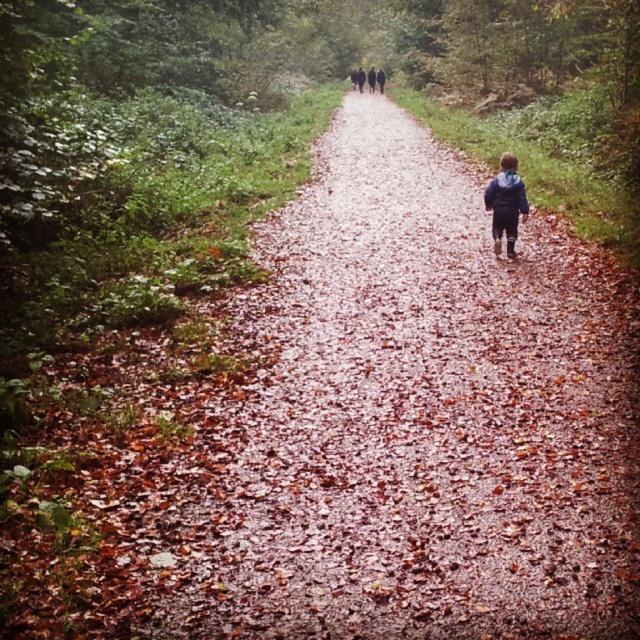
Question: Which point is farther to the camera?

Choices:
 (A) (381, 90)
 (B) (524, 624)

Answer: (A)

Question: Based on their relative distances, which object is farther from the dark blue jacket at center?

Choices:
 (A) brown leafy gravel path at center
 (B) blue fabric jacket at center

Answer: (B)

Question: Which object is closer to the camera taking this photo?

Choices:
 (A) dark blue jacket at center
 (B) blue fabric jacket at center
 (C) brown leafy gravel path at center

Answer: (C)

Question: Can you confirm if brown leafy gravel path at center is thinner than blue fabric jacket at center?

Choices:
 (A) yes
 (B) no

Answer: (B)

Question: In this image, where is blue fabric jacket at center located relative to dark blue jacket at center?

Choices:
 (A) above
 (B) below

Answer: (B)

Question: Does blue fabric jacket at center come behind dark blue jacket at center?

Choices:
 (A) yes
 (B) no

Answer: (B)